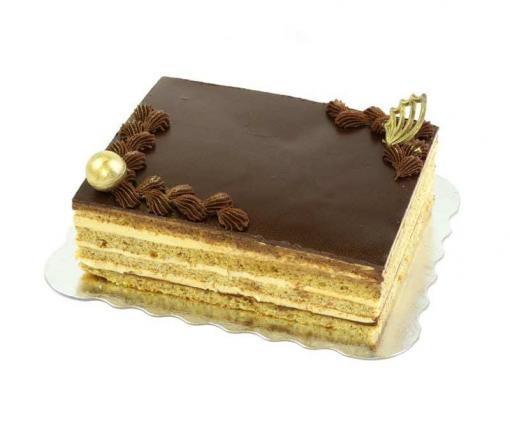
At what (x,y) coordinates should I click in order to perform the action: click on cake plate. Please return your answer as a coordinate pair (x, y). This screenshot has height=421, width=510. Looking at the image, I should click on (398, 347).